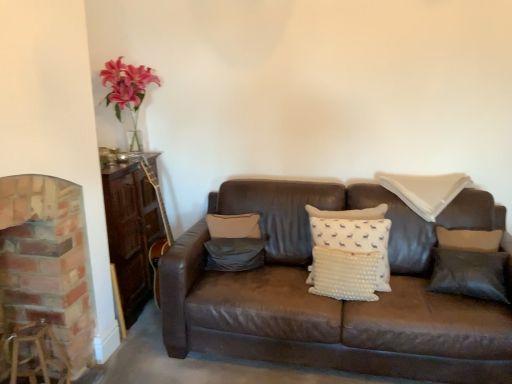
Question: Considering the relative positions of brick fireplace at left and white dotted pillow at upper right, the 3th pillow from the left, in the image provided, is brick fireplace at left behind white dotted pillow at upper right, the 3th pillow from the left,?

Choices:
 (A) no
 (B) yes

Answer: (A)

Question: Is white dotted pillow at upper right, acting as the 2th pillow starting from the right, at the back of brick fireplace at left?

Choices:
 (A) yes
 (B) no

Answer: (B)

Question: Can you confirm if brick fireplace at left is positioned to the left of white dotted pillow at upper right, the 3th pillow from the left?

Choices:
 (A) yes
 (B) no

Answer: (A)

Question: Is brick fireplace at left in front of white dotted pillow at upper right, acting as the 2th pillow starting from the right?

Choices:
 (A) no
 (B) yes

Answer: (B)

Question: Considering the relative sizes of brick fireplace at left and white dotted pillow at upper right, the 3th pillow from the left, in the image provided, is brick fireplace at left bigger than white dotted pillow at upper right, the 3th pillow from the left,?

Choices:
 (A) no
 (B) yes

Answer: (B)

Question: In terms of height, does black leather pillow at right, arranged as the fourth pillow when viewed from the left, look taller or shorter compared to wooden bar stool at lower left?

Choices:
 (A) short
 (B) tall

Answer: (B)

Question: Is black leather pillow at right, arranged as the fourth pillow when viewed from the left, to the left or to the right of wooden bar stool at lower left in the image?

Choices:
 (A) right
 (B) left

Answer: (A)

Question: In terms of size, does black leather pillow at right, arranged as the first pillow when viewed from the right, appear bigger or smaller than wooden bar stool at lower left?

Choices:
 (A) small
 (B) big

Answer: (A)

Question: In terms of width, does black leather pillow at right, arranged as the fourth pillow when viewed from the left, look wider or thinner when compared to wooden bar stool at lower left?

Choices:
 (A) wide
 (B) thin

Answer: (B)

Question: Is brick fireplace at left inside the boundaries of black leather pillow at right, arranged as the fourth pillow when viewed from the left, or outside?

Choices:
 (A) outside
 (B) inside

Answer: (A)

Question: Looking at the image, does brick fireplace at left seem bigger or smaller compared to black leather pillow at right, arranged as the first pillow when viewed from the right?

Choices:
 (A) small
 (B) big

Answer: (B)

Question: Based on their positions, is brick fireplace at left located to the left or right of black leather pillow at right, arranged as the fourth pillow when viewed from the left?

Choices:
 (A) right
 (B) left

Answer: (B)

Question: Does point (31, 276) appear closer or farther from the camera than point (501, 266)?

Choices:
 (A) farther
 (B) closer

Answer: (B)

Question: Considering the positions of black leather pillow at right, arranged as the first pillow when viewed from the right, and white dotted pillow at center, which is the second pillow in left-to-right order, in the image, is black leather pillow at right, arranged as the first pillow when viewed from the right, taller or shorter than white dotted pillow at center, which is the second pillow in left-to-right order,?

Choices:
 (A) tall
 (B) short

Answer: (B)

Question: Would you say black leather pillow at right, arranged as the first pillow when viewed from the right, is inside or outside white dotted pillow at center, the 3th pillow in the right-to-left sequence?

Choices:
 (A) outside
 (B) inside

Answer: (A)